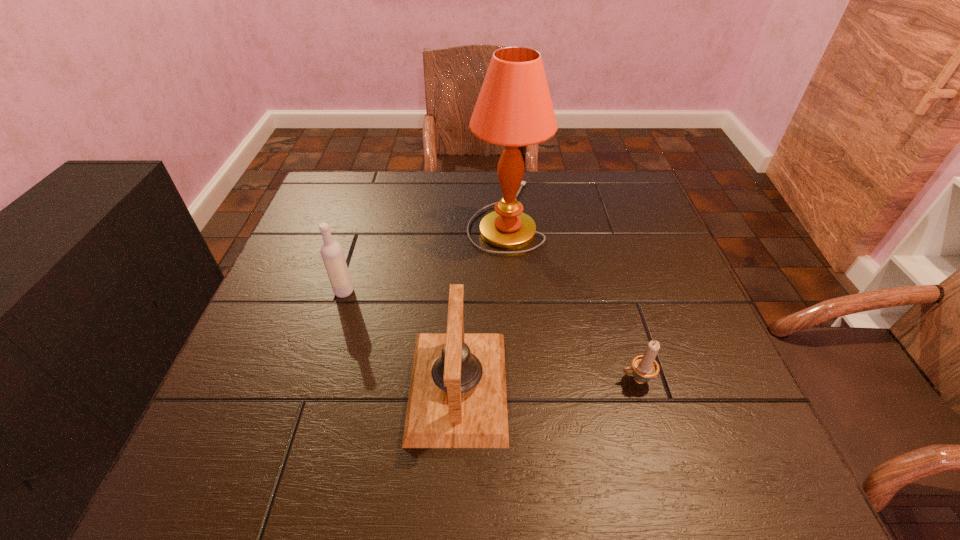
You are a GUI agent. You are given a task and a screenshot of the screen. Output one action in this format:
    pyautogui.click(x=<x>, y=<y>)
    Task: Click on the farthest object
    
    Given the screenshot: What is the action you would take?
    pyautogui.click(x=514, y=108)

You are a GUI agent. You are given a task and a screenshot of the screen. Output one action in this format:
    pyautogui.click(x=<x>, y=<y>)
    Task: Click on the tallest object
    The image size is (960, 540).
    Given the screenshot: What is the action you would take?
    pyautogui.click(x=514, y=108)

Where is `the third nearest object`? The width and height of the screenshot is (960, 540). the third nearest object is located at coordinates (331, 251).

The image size is (960, 540). In order to click on the leftmost object in this screenshot , I will do `click(331, 251)`.

I want to click on bell, so click(x=457, y=398).

This screenshot has height=540, width=960. What are the coordinates of `candle_holder` in the screenshot? It's located at (645, 367).

Locate an element on the screen. The image size is (960, 540). the rightmost object is located at coordinates (645, 367).

Find the location of a particular element. Image resolution: width=960 pixels, height=540 pixels. vacant space located 0.070m on the back of the tallest object is located at coordinates (501, 171).

Locate an element on the screen. vacant region located 0.140m on the front of the third nearest object is located at coordinates (325, 350).

Find the location of a particular element. free space located 0.400m on the back of the bell is located at coordinates (465, 219).